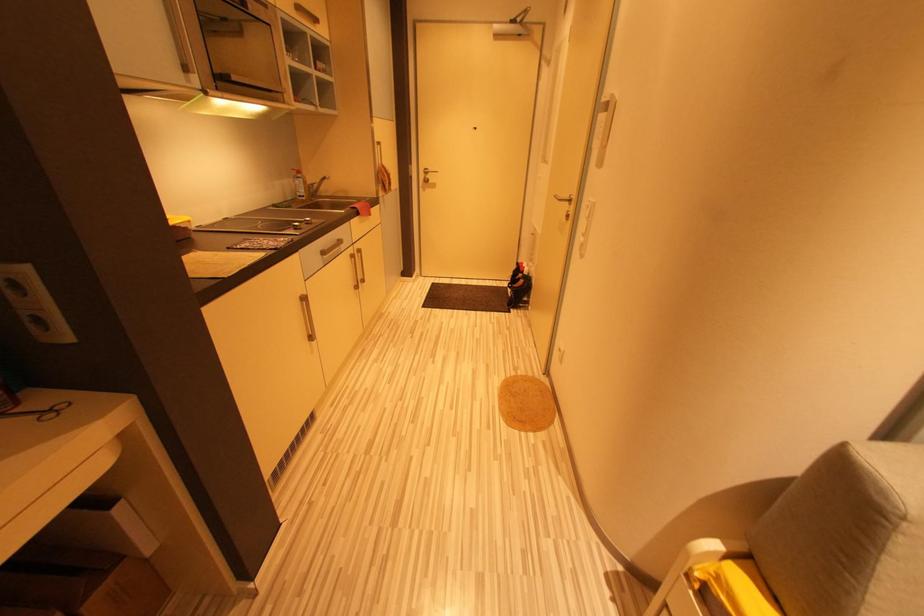
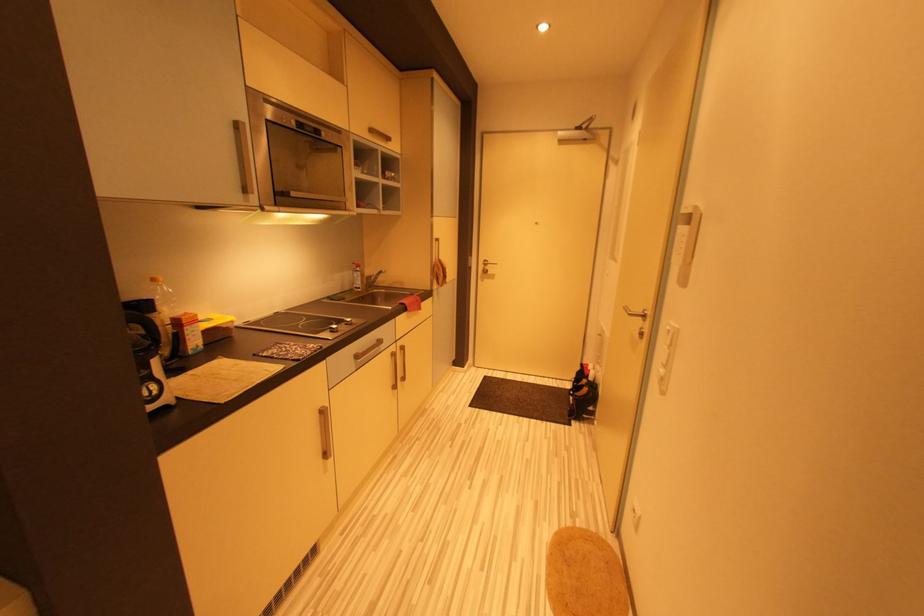
The images are taken continuously from a first-person perspective. In which direction are you moving?

The movement direction of the cameraman is right, forward.